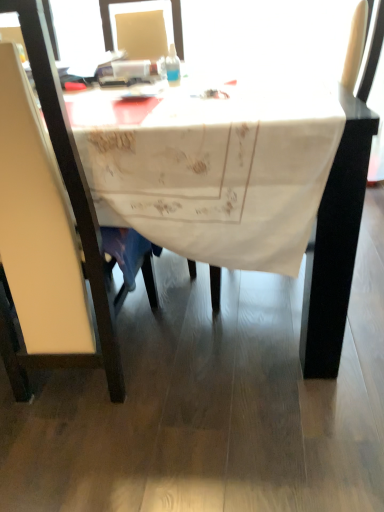
Question: Is transparent plastic bottle at center in front of or behind white leather chair at left in the image?

Choices:
 (A) front
 (B) behind

Answer: (B)

Question: Is transparent plastic bottle at center inside or outside of white leather chair at left?

Choices:
 (A) inside
 (B) outside

Answer: (B)

Question: Which of these objects is positioned farthest from the transparent plastic bottle at center?

Choices:
 (A) white embroidered tablecloth at center
 (B) white leather chair at left

Answer: (B)

Question: Estimate the real-world distances between objects in this image. Which object is closer to the transparent plastic bottle at center?

Choices:
 (A) white embroidered tablecloth at center
 (B) white leather chair at left

Answer: (A)